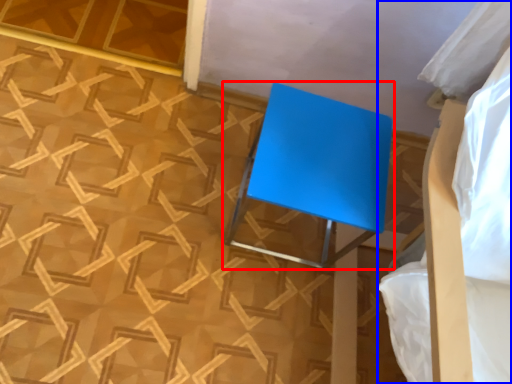
Question: Which point is further to the camera, furniture (highlighted by a red box) or bed (highlighted by a blue box)?

Choices:
 (A) furniture
 (B) bed

Answer: (A)